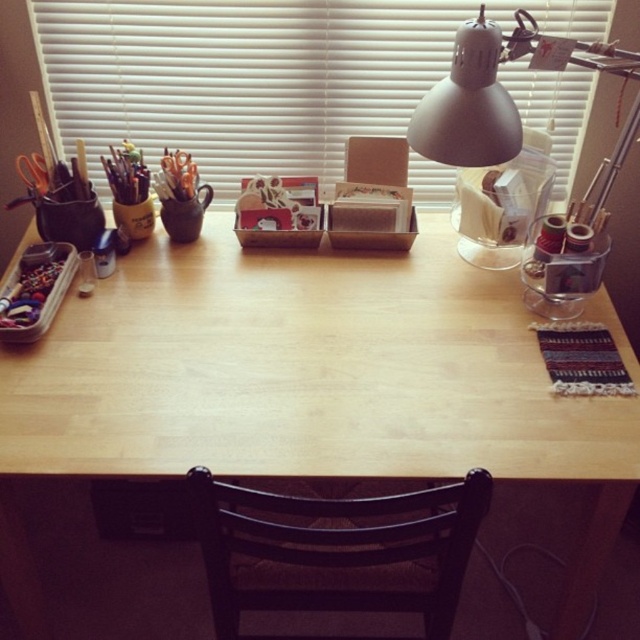
You are trying to place a new decorative item on the desk. The item requires a space wider than the brown wooden chair at lower center. Is there enough space next to the metallic silver beads at left?

The brown wooden chair at lower center might be wider than metallic silver beads at left, so it is uncertain if there is enough space next to the metallic silver beads at left for the item that requires a space wider than the brown wooden chair at lower center.